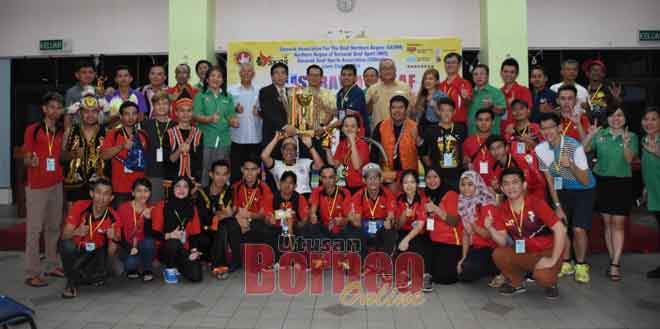
What are the coordinates of `green poster` in the screenshot? It's located at (55, 41).